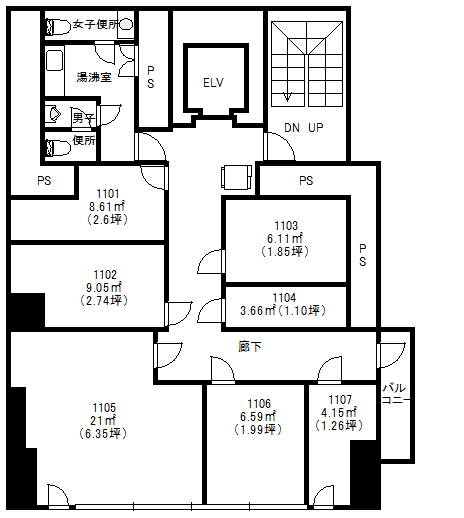
Locate an element on the screen. staircase is located at coordinates (321, 70).